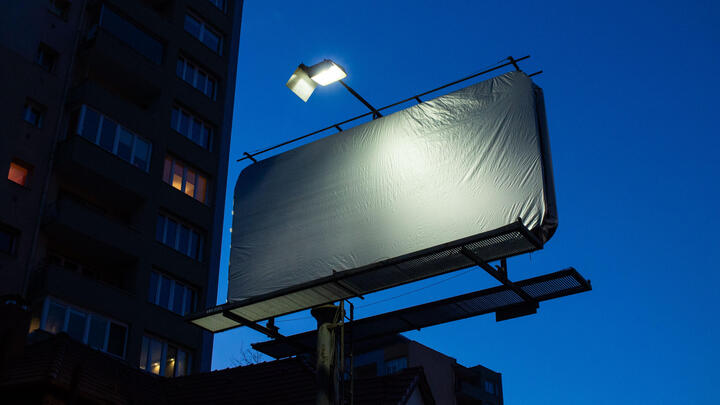
At what (x,y) coordinates should I click in order to perform the action: click on overhead light. Please return your answer as a coordinate pair (x, y). Looking at the image, I should click on 325,72, 309,88.